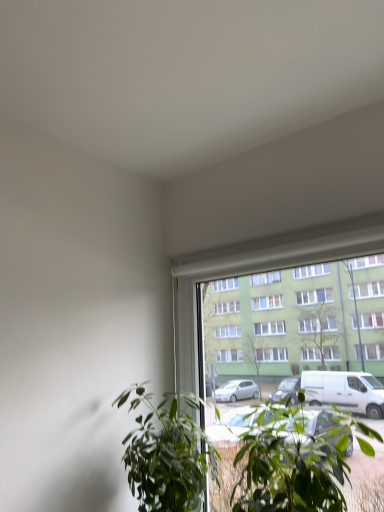
Locate an element on the screen. The height and width of the screenshot is (512, 384). green leafy plant at center, placed as the 2th houseplant when sorted from left to right is located at coordinates (237, 458).

Image resolution: width=384 pixels, height=512 pixels. What do you see at coordinates (237, 458) in the screenshot?
I see `green leafy plant at center, placed as the 2th houseplant when sorted from left to right` at bounding box center [237, 458].

The height and width of the screenshot is (512, 384). In order to click on green leafy plant at lower center, arranged as the first houseplant when viewed from the left in this screenshot , I will do `click(166, 454)`.

What do you see at coordinates (166, 454) in the screenshot?
I see `green leafy plant at lower center, the second houseplant positioned from the right` at bounding box center [166, 454].

In order to face green leafy plant at lower center, the second houseplant positioned from the right, should I rotate leftwards or rightwards?

To face it directly, rotate left by 2.105 degrees.

I want to click on green leafy plant at center, placed as the 2th houseplant when sorted from left to right, so click(237, 458).

Can you confirm if green leafy plant at lower center, arranged as the first houseplant when viewed from the left, is positioned to the right of green leafy plant at center, placed as the 2th houseplant when sorted from left to right?

No, green leafy plant at lower center, arranged as the first houseplant when viewed from the left, is not to the right of green leafy plant at center, placed as the 2th houseplant when sorted from left to right.

Considering the positions of objects green leafy plant at lower center, arranged as the first houseplant when viewed from the left, and green leafy plant at center, placed as the 2th houseplant when sorted from left to right, in the image provided, who is in front, green leafy plant at lower center, arranged as the first houseplant when viewed from the left, or green leafy plant at center, placed as the 2th houseplant when sorted from left to right,?

green leafy plant at center, placed as the 2th houseplant when sorted from left to right.

Considering the points (173, 460) and (260, 508), which point is in front, point (173, 460) or point (260, 508)?

Point (260, 508)

From the image's perspective, is green leafy plant at lower center, the second houseplant positioned from the right, located above or below green leafy plant at center, which appears as the 1th houseplant when viewed from the right?

green leafy plant at lower center, the second houseplant positioned from the right, is situated lower than green leafy plant at center, which appears as the 1th houseplant when viewed from the right, in the image.

From a real-world perspective, which object rests below the other?

green leafy plant at lower center, the second houseplant positioned from the right, from a real-world perspective.

Is green leafy plant at lower center, the second houseplant positioned from the right, wider than green leafy plant at center, placed as the 2th houseplant when sorted from left to right?

Incorrect, the width of green leafy plant at lower center, the second houseplant positioned from the right, does not surpass that of green leafy plant at center, placed as the 2th houseplant when sorted from left to right.

Considering the relative sizes of green leafy plant at lower center, the second houseplant positioned from the right, and green leafy plant at center, which appears as the 1th houseplant when viewed from the right, in the image provided, is green leafy plant at lower center, the second houseplant positioned from the right, taller than green leafy plant at center, which appears as the 1th houseplant when viewed from the right,?

Yes.

Between green leafy plant at lower center, the second houseplant positioned from the right, and green leafy plant at center, which appears as the 1th houseplant when viewed from the right, which one has larger size?

green leafy plant at center, which appears as the 1th houseplant when viewed from the right, is bigger.

Would you say green leafy plant at lower center, arranged as the first houseplant when viewed from the left, is inside or outside green leafy plant at center, placed as the 2th houseplant when sorted from left to right?

green leafy plant at lower center, arranged as the first houseplant when viewed from the left, exists outside the volume of green leafy plant at center, placed as the 2th houseplant when sorted from left to right.

From the picture: Are green leafy plant at lower center, the second houseplant positioned from the right, and green leafy plant at center, placed as the 2th houseplant when sorted from left to right, beside each other?

Yes.

Is green leafy plant at lower center, the second houseplant positioned from the right, turned away from green leafy plant at center, which appears as the 1th houseplant when viewed from the right?

No, green leafy plant at center, which appears as the 1th houseplant when viewed from the right, is not at the back of green leafy plant at lower center, the second houseplant positioned from the right.

How many degrees apart are the facing directions of green leafy plant at lower center, the second houseplant positioned from the right, and green leafy plant at center, placed as the 2th houseplant when sorted from left to right?

The angle between the facing direction of green leafy plant at lower center, the second houseplant positioned from the right, and the facing direction of green leafy plant at center, placed as the 2th houseplant when sorted from left to right, is 0.000136 degrees.

How much distance is there between green leafy plant at lower center, the second houseplant positioned from the right, and green leafy plant at center, which appears as the 1th houseplant when viewed from the right?

green leafy plant at lower center, the second houseplant positioned from the right, is 8.08 centimeters away from green leafy plant at center, which appears as the 1th houseplant when viewed from the right.

The width and height of the screenshot is (384, 512). I want to click on houseplant behind the green leafy plant at center, placed as the 2th houseplant when sorted from left to right, so click(166, 454).

Considering the relative positions of green leafy plant at center, placed as the 2th houseplant when sorted from left to right, and green leafy plant at lower center, the second houseplant positioned from the right, in the image provided, is green leafy plant at center, placed as the 2th houseplant when sorted from left to right, to the right of green leafy plant at lower center, the second houseplant positioned from the right, from the viewer's perspective?

Yes.

Is the depth of green leafy plant at center, which appears as the 1th houseplant when viewed from the right, less than that of green leafy plant at lower center, arranged as the first houseplant when viewed from the left?

That is True.

Considering the positions of point (175, 496) and point (191, 449), is point (175, 496) closer or farther from the camera than point (191, 449)?

Point (175, 496) appears to be closer to the viewer than point (191, 449).

From the image's perspective, is green leafy plant at center, placed as the 2th houseplant when sorted from left to right, positioned above or below green leafy plant at lower center, the second houseplant positioned from the right?

green leafy plant at center, placed as the 2th houseplant when sorted from left to right, is situated higher than green leafy plant at lower center, the second houseplant positioned from the right, in the image.

From a real-world perspective, is green leafy plant at center, which appears as the 1th houseplant when viewed from the right, physically located above or below green leafy plant at lower center, arranged as the first houseplant when viewed from the left?

From a real-world perspective, green leafy plant at center, which appears as the 1th houseplant when viewed from the right, is physically above green leafy plant at lower center, arranged as the first houseplant when viewed from the left.

Between green leafy plant at center, placed as the 2th houseplant when sorted from left to right, and green leafy plant at lower center, the second houseplant positioned from the right, which one has larger width?

green leafy plant at center, placed as the 2th houseplant when sorted from left to right, is wider.

Can you confirm if green leafy plant at center, placed as the 2th houseplant when sorted from left to right, is taller than green leafy plant at lower center, arranged as the first houseplant when viewed from the left?

No, green leafy plant at center, placed as the 2th houseplant when sorted from left to right, is not taller than green leafy plant at lower center, arranged as the first houseplant when viewed from the left.

Is green leafy plant at center, which appears as the 1th houseplant when viewed from the right, bigger or smaller than green leafy plant at lower center, arranged as the first houseplant when viewed from the left?

In the image, green leafy plant at center, which appears as the 1th houseplant when viewed from the right, appears to be larger than green leafy plant at lower center, arranged as the first houseplant when viewed from the left.

Looking at this image, is green leafy plant at center, placed as the 2th houseplant when sorted from left to right, positioned beyond the bounds of green leafy plant at lower center, arranged as the first houseplant when viewed from the left?

green leafy plant at center, placed as the 2th houseplant when sorted from left to right, lies outside green leafy plant at lower center, arranged as the first houseplant when viewed from the left,'s area.

Is there a large distance between green leafy plant at center, placed as the 2th houseplant when sorted from left to right, and green leafy plant at lower center, the second houseplant positioned from the right?

Actually, green leafy plant at center, placed as the 2th houseplant when sorted from left to right, and green leafy plant at lower center, the second houseplant positioned from the right, are a little close together.

Is green leafy plant at center, which appears as the 1th houseplant when viewed from the right, turned away from green leafy plant at lower center, the second houseplant positioned from the right?

No, green leafy plant at center, which appears as the 1th houseplant when viewed from the right, is not facing the opposite direction of green leafy plant at lower center, the second houseplant positioned from the right.

How much distance is there between green leafy plant at center, placed as the 2th houseplant when sorted from left to right, and green leafy plant at lower center, the second houseplant positioned from the right?

green leafy plant at center, placed as the 2th houseplant when sorted from left to right, is 3.18 inches from green leafy plant at lower center, the second houseplant positioned from the right.

Where is `houseplant lying on the right of green leafy plant at lower center, arranged as the first houseplant when viewed from the left`? houseplant lying on the right of green leafy plant at lower center, arranged as the first houseplant when viewed from the left is located at coordinates (237, 458).

Locate an element on the screen. Image resolution: width=384 pixels, height=512 pixels. houseplant that appears above the green leafy plant at lower center, the second houseplant positioned from the right (from a real-world perspective) is located at coordinates (237, 458).

In the image, there is a green leafy plant at center, which appears as the 1th houseplant when viewed from the right. Identify the location of houseplant below it (from the image's perspective). This screenshot has height=512, width=384. (166, 454).